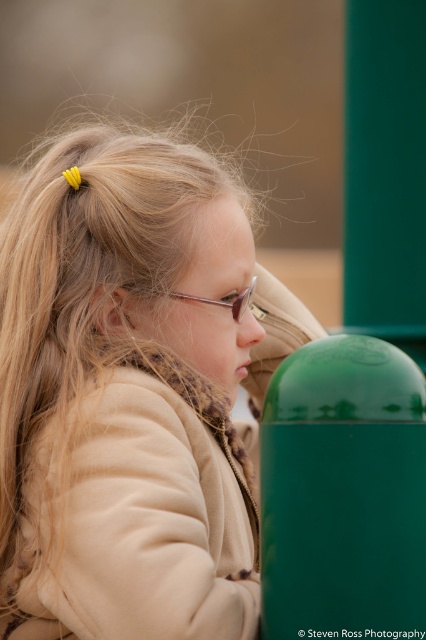
Between point (75, 362) and point (245, 291), which one is positioned in front?

Positioned in front is point (75, 362).

Is point (20, 316) closer to viewer compared to point (224, 305)?

Yes, it is in front of point (224, 305).

Find the location of a particular element. Image resolution: width=426 pixels, height=640 pixels. matte beige coat at center is located at coordinates (132, 394).